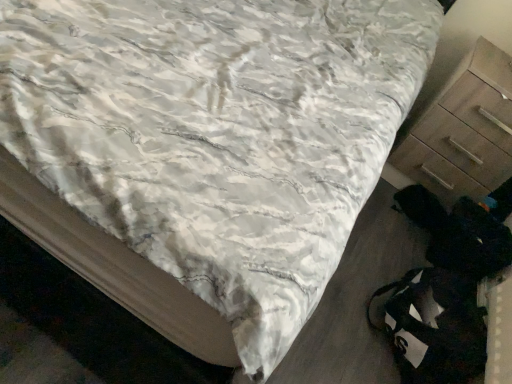
Locate an element on the screen. This screenshot has height=384, width=512. wooden chest of drawers at right is located at coordinates (464, 130).

This screenshot has height=384, width=512. Describe the element at coordinates (464, 130) in the screenshot. I see `wooden chest of drawers at right` at that location.

Measure the distance between point (460, 112) and camera.

5.97 feet.

The width and height of the screenshot is (512, 384). Identify the location of wooden chest of drawers at right. (464, 130).